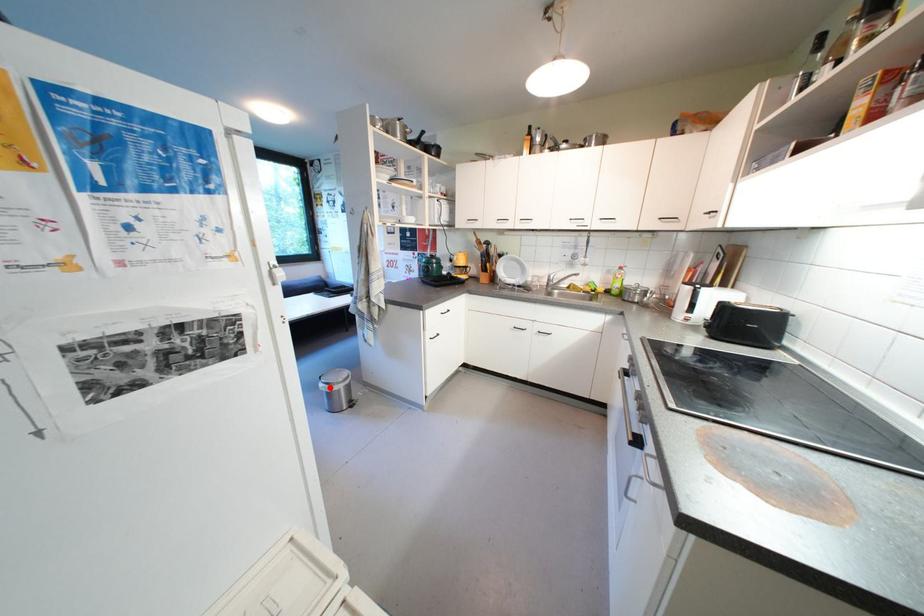
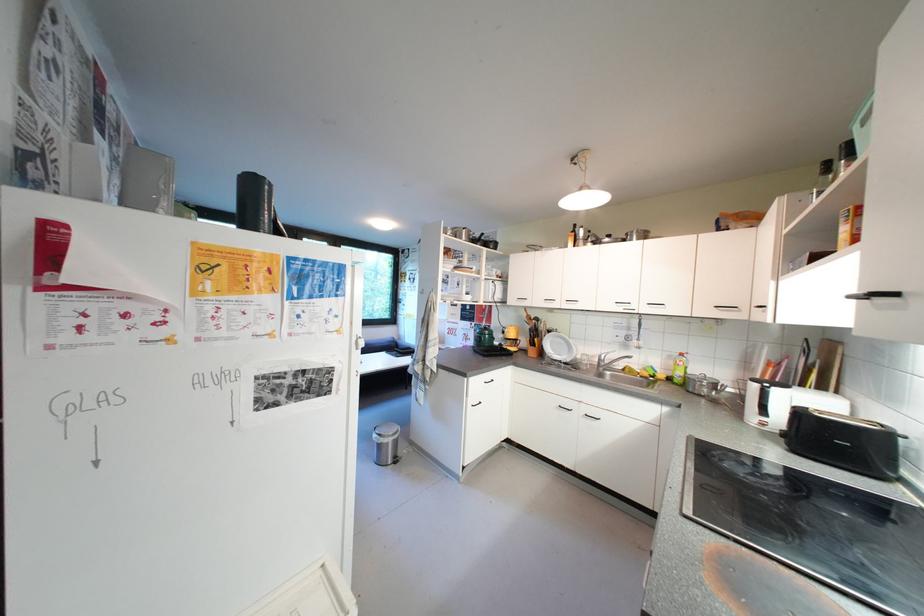
The point at the highlighted location is marked in the first image. Where is the corresponding point in the second image?

(383, 438)